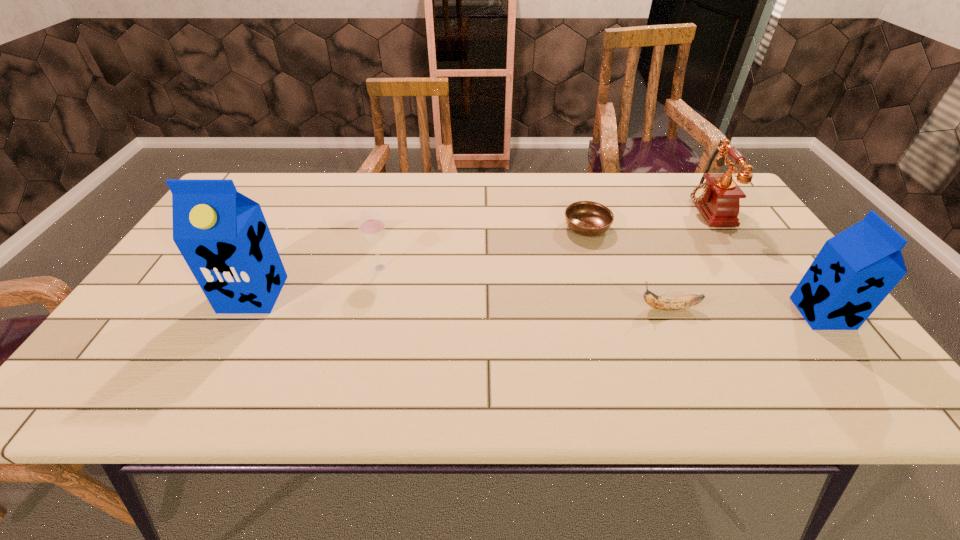
Locate an element on the screen. empty space between the banana and the telephone is located at coordinates (686, 258).

Locate an element on the screen. The width and height of the screenshot is (960, 540). vacant region between the third shortest object and the fourth shortest object is located at coordinates (542, 238).

The width and height of the screenshot is (960, 540). What are the coordinates of `free space between the banana and the rightmost object` in the screenshot? It's located at (746, 310).

Identify the location of the fourth closest object relative to the shortest object. (371, 225).

Identify the location of the fourth closest object to the soup bowl. (371, 225).

Identify the location of vacant space that satisfies the following two spatial constraints: 1. on the dial of the third tallest object; 2. with the cap open on the leftmost object. The width and height of the screenshot is (960, 540). (760, 294).

Locate an element on the screen. vacant area that satisfies the following two spatial constraints: 1. on the dial of the third tallest object; 2. on the front side of the fifth object from right to left is located at coordinates (743, 268).

Locate an element on the screen. vacant space that satisfies the following two spatial constraints: 1. on the dial of the fourth shortest object; 2. on the front side of the wineglass is located at coordinates (743, 268).

The width and height of the screenshot is (960, 540). Find the location of `vacant area that satisfies the following two spatial constraints: 1. on the back side of the shortest object; 2. on the left side of the fifth object from right to left`. vacant area that satisfies the following two spatial constraints: 1. on the back side of the shortest object; 2. on the left side of the fifth object from right to left is located at coordinates (390, 227).